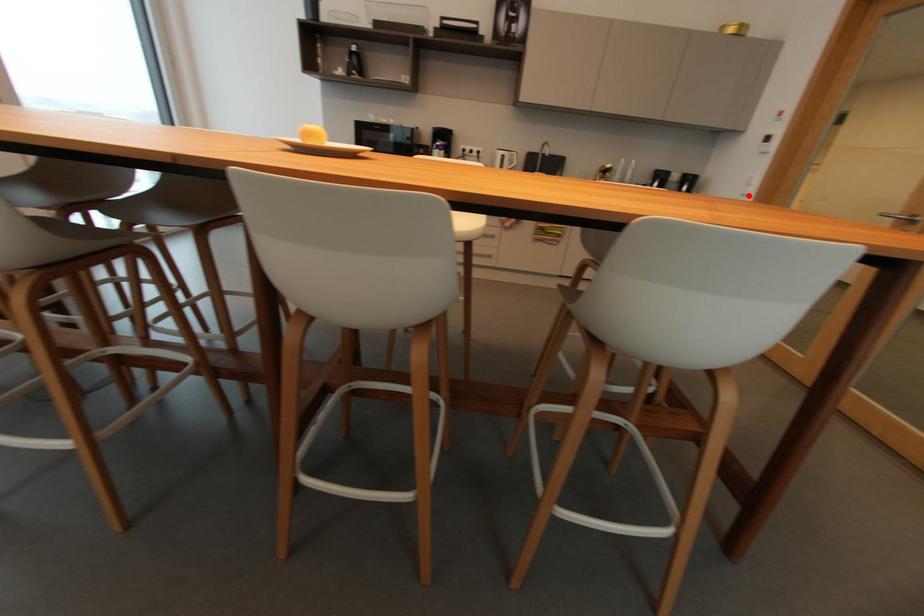
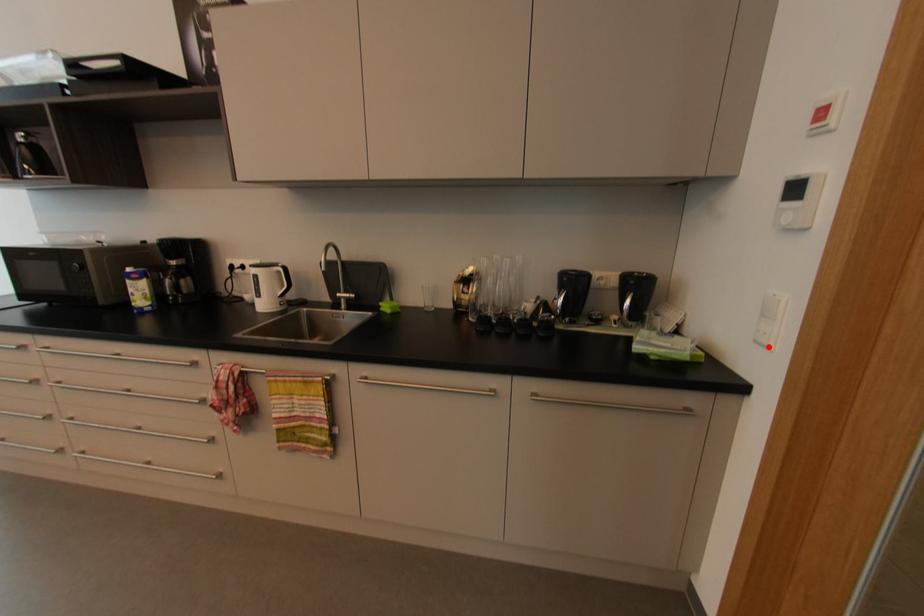
I am providing you with two images of the same scene from different viewpoints. A red point is marked on the first image and another point is marked on the second image. Are the points marked in image1 and image2 representing the same 3D position?

Yes